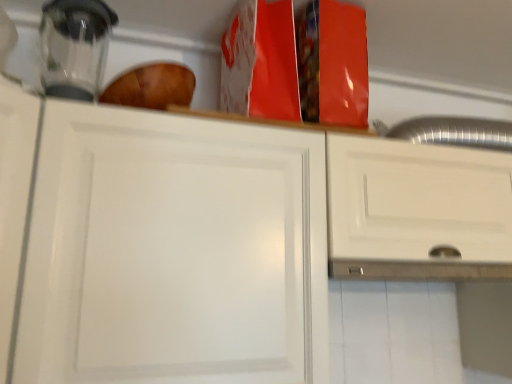
What do you see at coordinates (74, 47) in the screenshot? I see `transparent glass blender at upper left` at bounding box center [74, 47].

What is the approximate width of transparent glass blender at upper left?

5.79 inches.

Where is `transparent glass blender at upper left`? transparent glass blender at upper left is located at coordinates (74, 47).

Find the location of `transparent glass blender at upper left`. transparent glass blender at upper left is located at coordinates (74, 47).